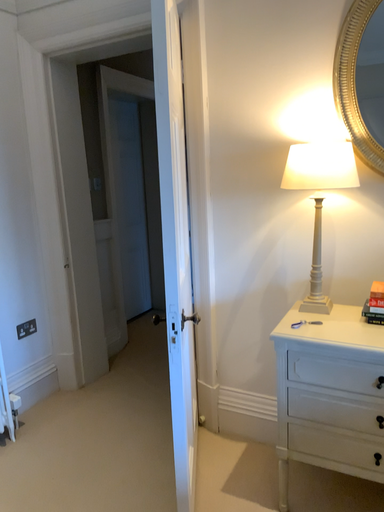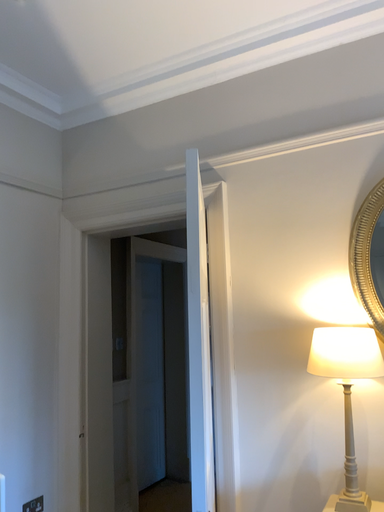
Question: Which way did the camera rotate in the video?

Choices:
 (A) rotated downward
 (B) rotated upward

Answer: (B)